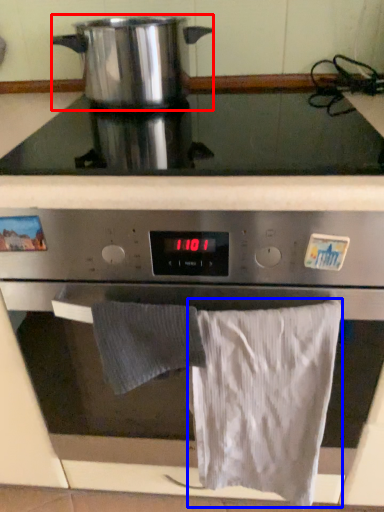
Question: Which object appears farthest to the camera in this image, kitchen appliance (highlighted by a red box) or bath towel (highlighted by a blue box)?

Choices:
 (A) kitchen appliance
 (B) bath towel

Answer: (A)